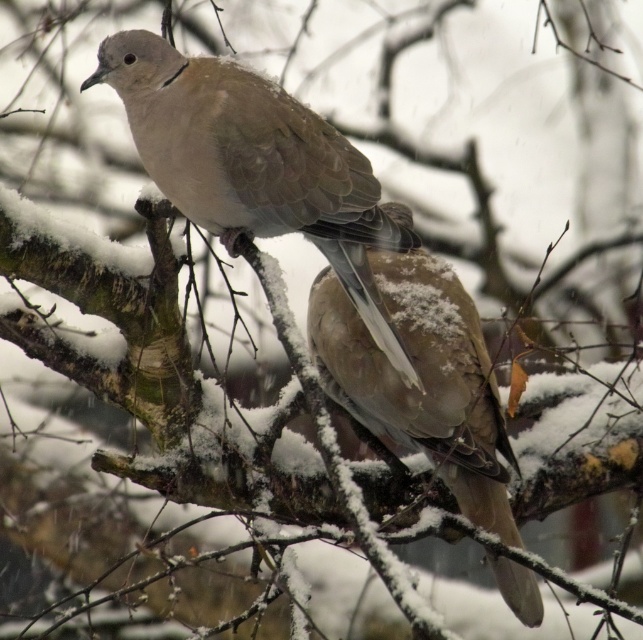
How far apart are matte brown dove at center and fuzzy brown pigeon at center?

matte brown dove at center is 17.88 inches from fuzzy brown pigeon at center.

Between point (168, 136) and point (458, 461), which one is positioned behind?

Point (458, 461)

The height and width of the screenshot is (640, 643). What are the coordinates of `matte brown dove at center` in the screenshot? It's located at (255, 164).